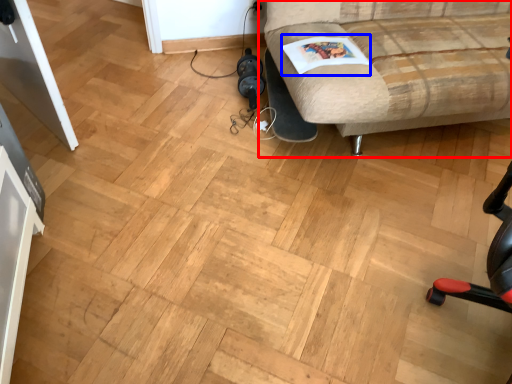
Question: Which point is further to the camera, studio couch (highlighted by a red box) or magazine (highlighted by a blue box)?

Choices:
 (A) studio couch
 (B) magazine

Answer: (B)